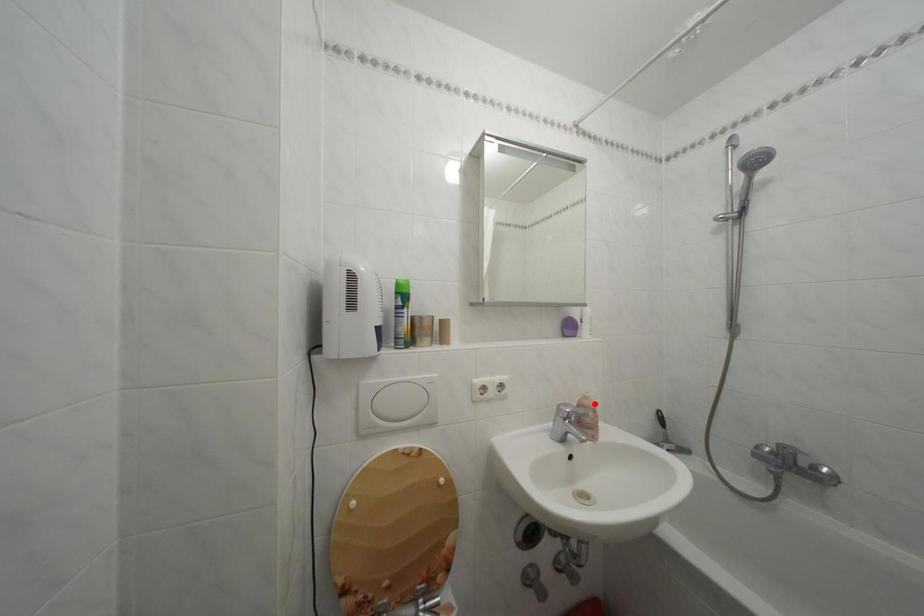
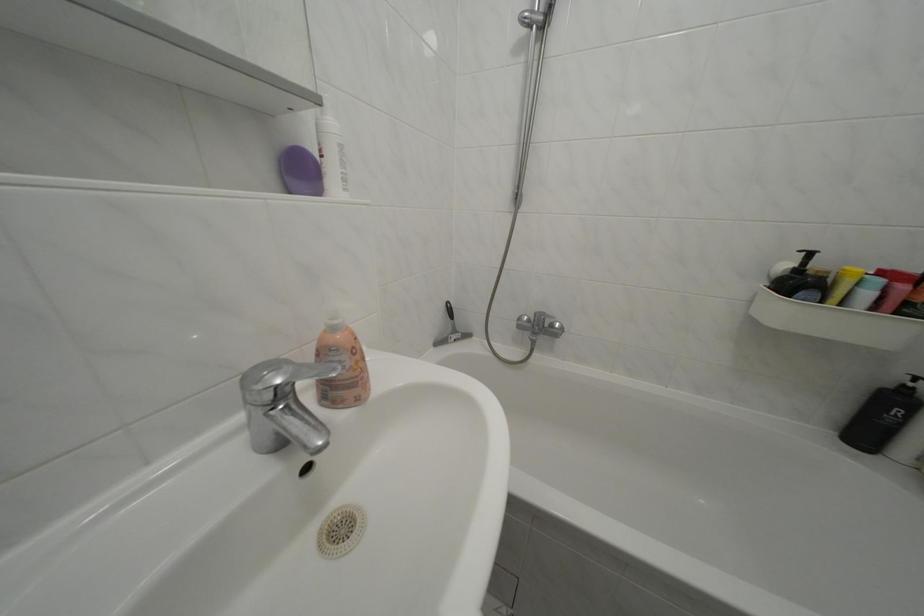
Where in the second image is the point corresponding to the highlighted location from the first image?

(342, 334)